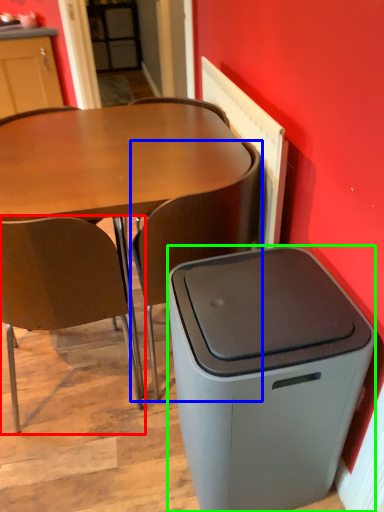
Question: Estimate the real-world distances between objects in this image. Which object is farther from chair (highlighted by a red box), chair (highlighted by a blue box) or trash bin/can (highlighted by a green box)?

Choices:
 (A) chair
 (B) trash bin/can

Answer: (B)